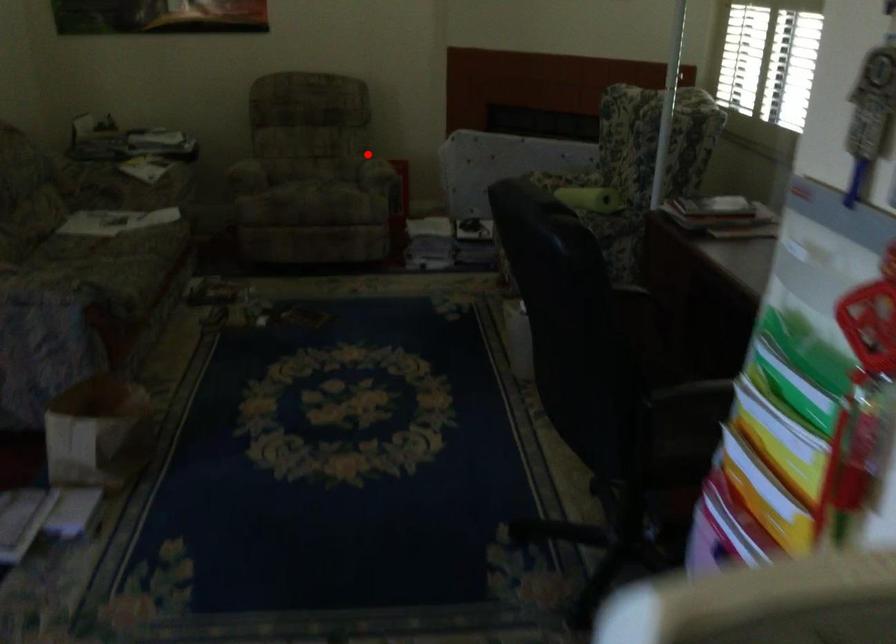
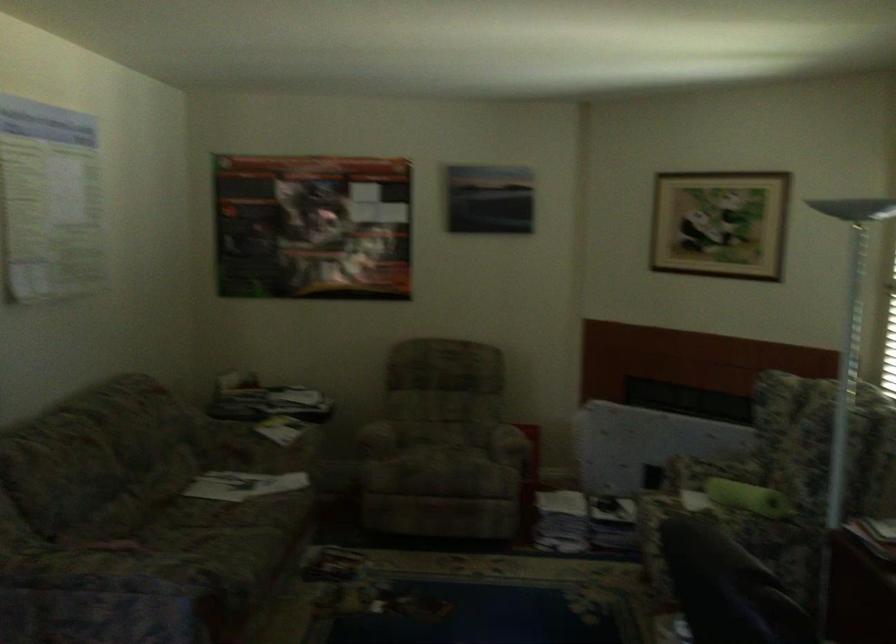
Where in the second image is the point corresponding to the highlighted location from the first image?

(506, 424)